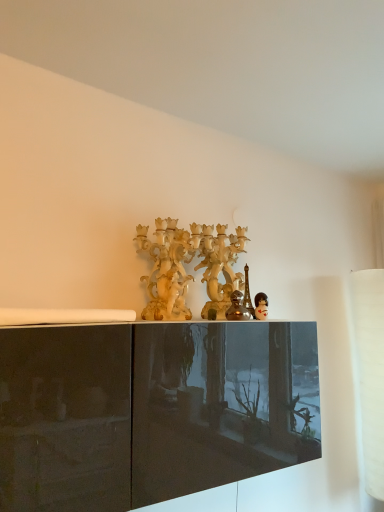
Question: Is matte cream candelabra at center oriented away from matte black doll at center?

Choices:
 (A) yes
 (B) no

Answer: (B)

Question: Considering the relative positions of matte cream candelabra at center and matte black doll at center in the image provided, is matte cream candelabra at center to the left of matte black doll at center from the viewer's perspective?

Choices:
 (A) no
 (B) yes

Answer: (B)

Question: Would you say matte cream candelabra at center is a long distance from matte black doll at center?

Choices:
 (A) no
 (B) yes

Answer: (A)

Question: Considering the relative positions of matte cream candelabra at center and matte black doll at center in the image provided, is matte cream candelabra at center in front of matte black doll at center?

Choices:
 (A) yes
 (B) no

Answer: (B)

Question: Is matte cream candelabra at center to the right of matte black doll at center from the viewer's perspective?

Choices:
 (A) yes
 (B) no

Answer: (B)

Question: Does matte cream candelabra at center have a larger size compared to matte black doll at center?

Choices:
 (A) yes
 (B) no

Answer: (A)

Question: Can you confirm if metallic silver figurine at center is thinner than matte cream candelabra at center?

Choices:
 (A) no
 (B) yes

Answer: (B)

Question: Is metallic silver figurine at center wider than matte cream candelabra at center?

Choices:
 (A) yes
 (B) no

Answer: (B)

Question: From a real-world perspective, is metallic silver figurine at center located beneath matte cream candelabra at center?

Choices:
 (A) no
 (B) yes

Answer: (B)

Question: Considering the relative positions of metallic silver figurine at center and matte cream candelabra at center in the image provided, is metallic silver figurine at center to the right of matte cream candelabra at center from the viewer's perspective?

Choices:
 (A) no
 (B) yes

Answer: (B)

Question: Does metallic silver figurine at center have a larger size compared to matte cream candelabra at center?

Choices:
 (A) no
 (B) yes

Answer: (A)

Question: From the image's perspective, does metallic silver figurine at center appear higher than matte cream candelabra at center?

Choices:
 (A) no
 (B) yes

Answer: (A)

Question: From the image's perspective, is matte black doll at center on metallic silver figurine at center?

Choices:
 (A) no
 (B) yes

Answer: (A)